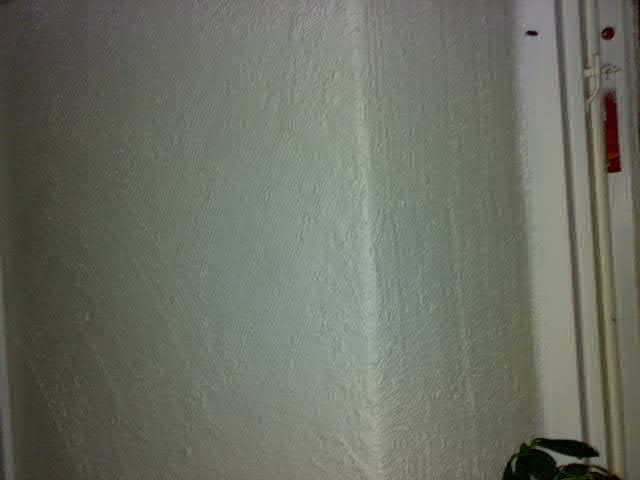
Where is `more molding on the opposite side of the wall`? This screenshot has width=640, height=480. more molding on the opposite side of the wall is located at coordinates (9, 438), (4, 397).